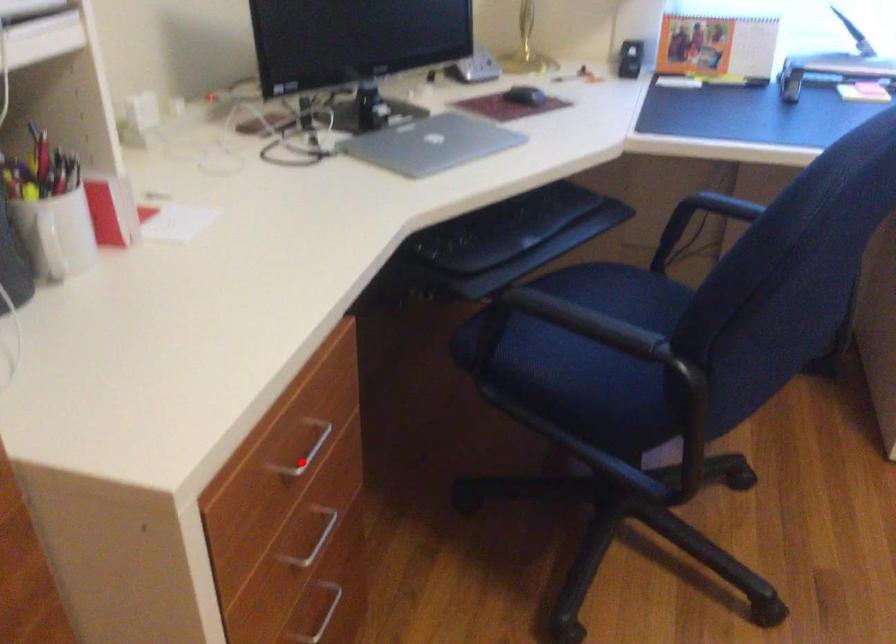
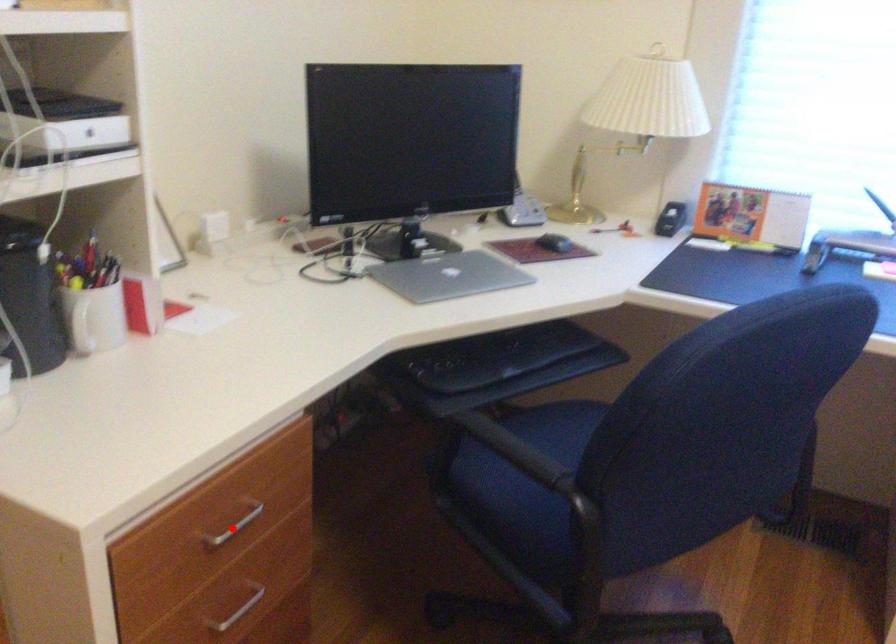
I am providing you with two images of the same scene from different viewpoints. A red point is marked on the first image and another point is marked on the second image. Are the points marked in image1 and image2 representing the same 3D position?

Yes